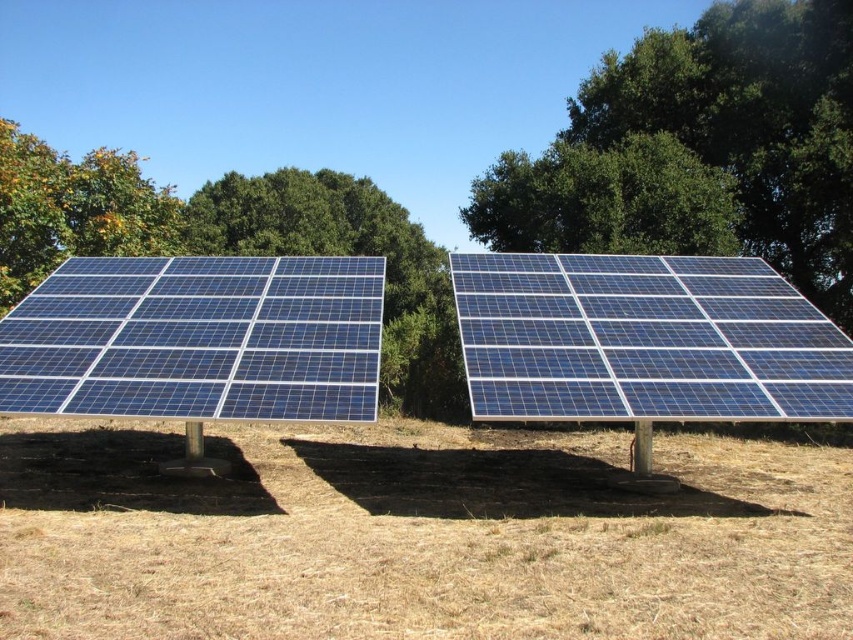
You are standing at the origin point in the image and want to walk to the brown dry grass at center. In which direction should you move?

The brown dry grass at center is located at point 0.838 on the x axis and 0.490 on the y axis. Since you are at the origin point, you should move towards the positive x direction and slightly towards the positive y direction to reach it.

You are a landscape architect designing a solar farm. You need to ensure that the green leafy tree at upper center and the green leafy tree at center do not block sunlight from reaching the solar panels. Which tree should you consider trimming first to minimize shading on the panels?

The green leafy tree at upper center has a lesser width compared to the green leafy tree at center. Since the tree at center is wider, it likely casts a larger shadow and would be the first to consider trimming to minimize shading on the solar panels.